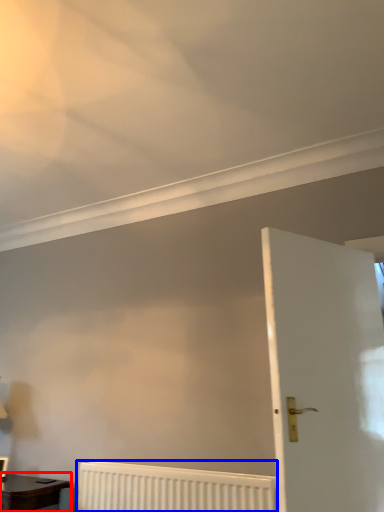
Question: Among these objects, which one is nearest to the camera, table (highlighted by a red box) or radiator (highlighted by a blue box)?

Choices:
 (A) table
 (B) radiator

Answer: (B)